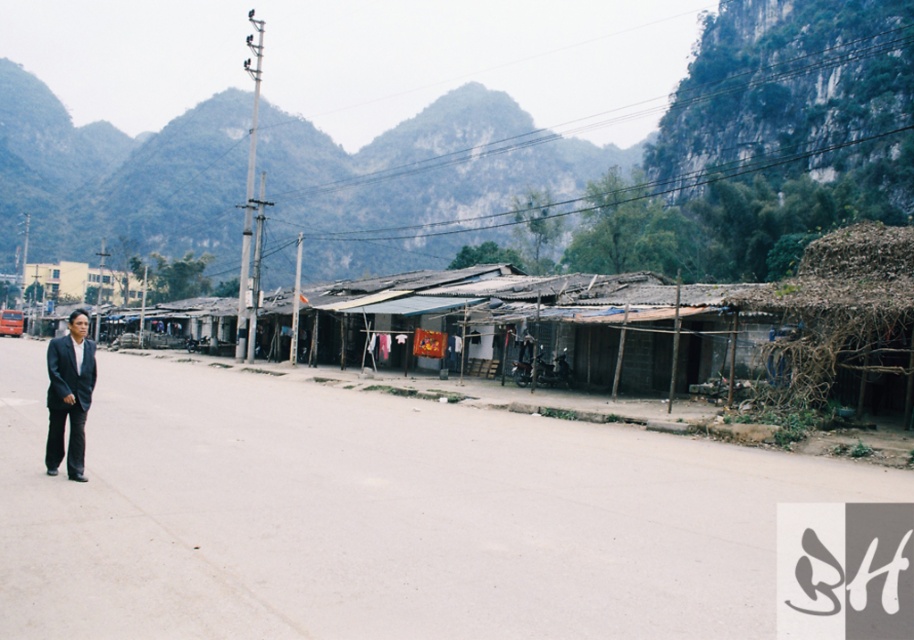
Does green rocky mountain at upper center have a greater height compared to matte black suit at left?

Indeed, green rocky mountain at upper center has a greater height compared to matte black suit at left.

In the scene shown: Who is more forward, [339,209] or [75,376]?

Point [75,376] is in front.

This screenshot has height=640, width=914. Identify the location of green rocky mountain at upper center. (119, 177).